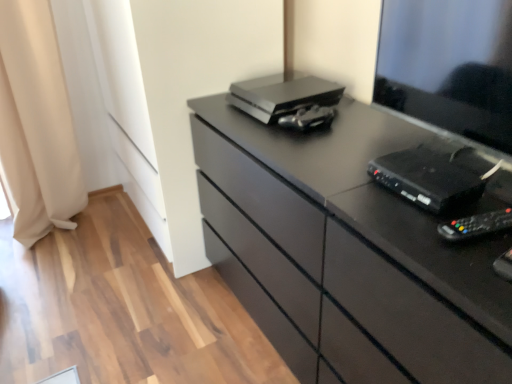
Where is `vacant space that is in between black plastic device at right, which is counted as the second equipment, starting from the back, and black plastic remote control at right, the 3th equipment viewed from the top`? vacant space that is in between black plastic device at right, which is counted as the second equipment, starting from the back, and black plastic remote control at right, the 3th equipment viewed from the top is located at coordinates (429, 208).